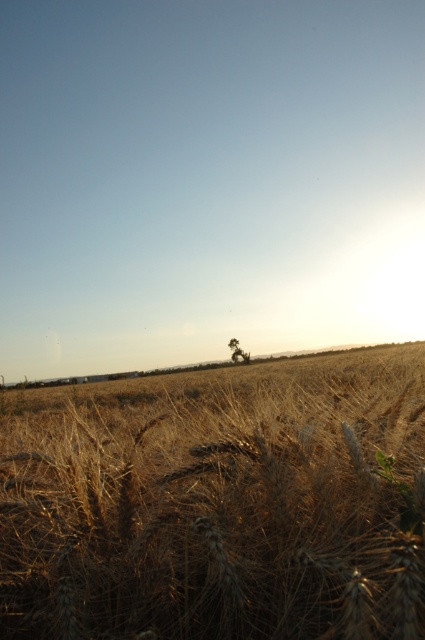
You are a photographer trying to capture the brown textured wheat at center and the brown textured tree at center in a single frame. Which object will appear bigger in the photo?

The brown textured wheat at center will appear bigger in the photo because it has a larger size compared to the brown textured tree at center.

You are a photographer standing in the field and want to capture both the brown textured wheat at center and the brown textured tree at center in your shot. Based on their positions, which one will appear larger in the photo?

The brown textured wheat at center will appear larger in the photo since it is closer to the viewer than the brown textured tree at center.

You are a photographer who wants to capture the brown textured tree at center in the background. Based on the scene description, will the brown textured wheat at center be in front of or behind the tree?

The brown textured wheat at center is positioned over brown textured tree at center, meaning the wheat is in front of the tree, blocking part of the tree from view.